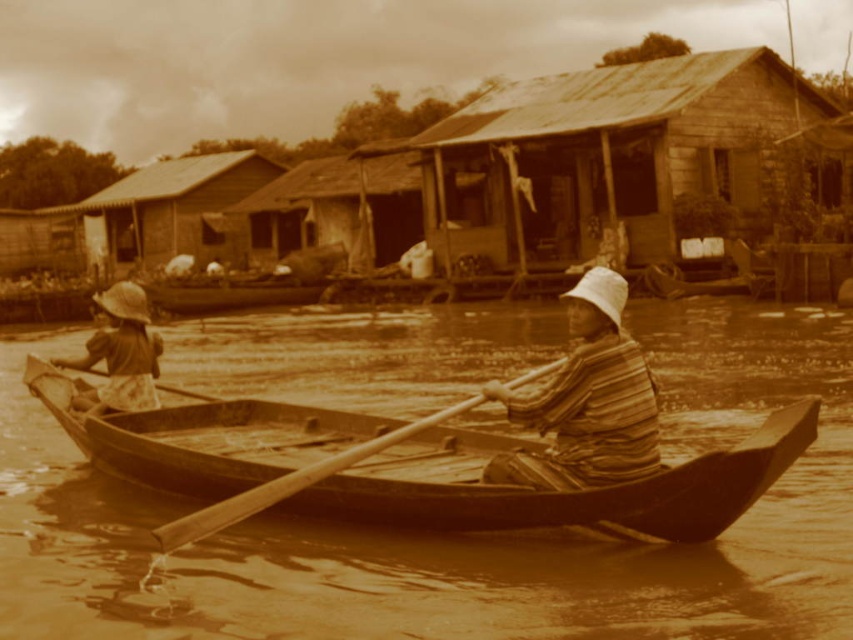
Is weathered wood houses at upper center taller than rustic wood hut at center?

Indeed, weathered wood houses at upper center has a greater height compared to rustic wood hut at center.

Can you confirm if weathered wood houses at upper center is bigger than rustic wood hut at center?

Indeed, weathered wood houses at upper center has a larger size compared to rustic wood hut at center.

Describe the element at coordinates (527, 177) in the screenshot. I see `weathered wood houses at upper center` at that location.

This screenshot has width=853, height=640. What are the coordinates of `weathered wood houses at upper center` in the screenshot? It's located at (527, 177).

Can you confirm if weathered wood houses at upper center is positioned above rusty metal hut at center?

No.

Which is behind, point (527, 113) or point (631, 88)?

Point (527, 113)

Locate an element on the screen. weathered wood houses at upper center is located at coordinates (527, 177).

Can you confirm if wooden canoe at center is taller than striped fabric hat at center?

Incorrect, wooden canoe at center's height is not larger of striped fabric hat at center's.

Who is positioned more to the left, wooden canoe at center or striped fabric hat at center?

From the viewer's perspective, wooden canoe at center appears more on the left side.

Describe the element at coordinates (415, 467) in the screenshot. I see `wooden canoe at center` at that location.

You are a GUI agent. You are given a task and a screenshot of the screen. Output one action in this format:
    pyautogui.click(x=<x>, y=<y>)
    Task: Click on the wooden canoe at center
    
    Given the screenshot: What is the action you would take?
    tap(415, 467)